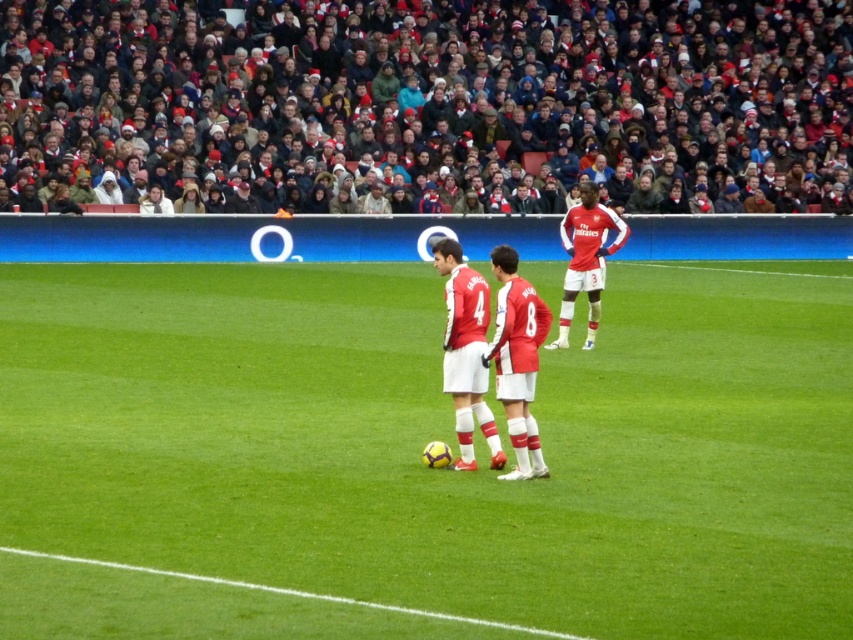
Question: Which of these objects is positioned closest to the matte red jersey at center?

Choices:
 (A) green grass at lower center
 (B) red scarf at upper center

Answer: (A)

Question: Is smooth green grass at center above green grass at lower center?

Choices:
 (A) no
 (B) yes

Answer: (B)

Question: Estimate the real-world distances between objects in this image. Which object is farther from the matte red jersey at center?

Choices:
 (A) red scarf at upper center
 (B) smooth green grass at center

Answer: (A)

Question: Which point is farther to the camera?

Choices:
 (A) (425, 125)
 (B) (496, 460)
 (C) (433, 483)
 (D) (456, 618)

Answer: (A)

Question: Is smooth green grass at center above red scarf at upper center?

Choices:
 (A) no
 (B) yes

Answer: (A)

Question: Is matte red jersey at center in front of green grass at lower center?

Choices:
 (A) yes
 (B) no

Answer: (B)